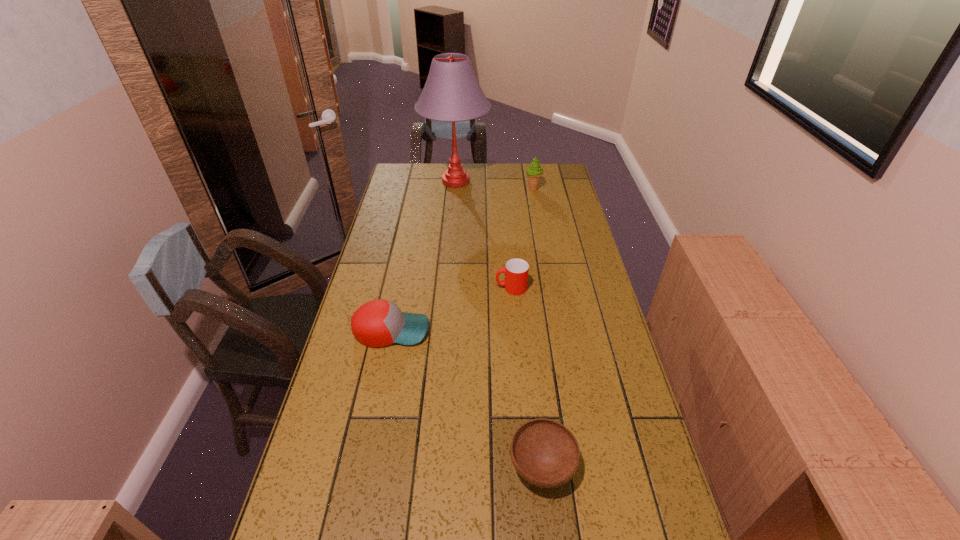
Identify which object is located as the fourth nearest to the icecream. Please provide its 2D coordinates. Your answer should be formatted as a tuple, i.e. [(x, y)], where the tuple contains the x and y coordinates of a point satisfying the conditions above.

[(545, 453)]

Find the location of `vacant space that satisfies the following two spatial constraints: 1. on the side of the fourth shortest object with the handle; 2. on the left side of the third nearest object`. vacant space that satisfies the following two spatial constraints: 1. on the side of the fourth shortest object with the handle; 2. on the left side of the third nearest object is located at coordinates (503, 189).

Locate an element on the screen. The height and width of the screenshot is (540, 960). vacant space that satisfies the following two spatial constraints: 1. at the brim of the nearest object; 2. on the left side of the fourth farthest object is located at coordinates (364, 467).

Locate an element on the screen. The height and width of the screenshot is (540, 960). vacant area that satisfies the following two spatial constraints: 1. on the front-facing side of the bowl; 2. on the right side of the tallest object is located at coordinates (432, 467).